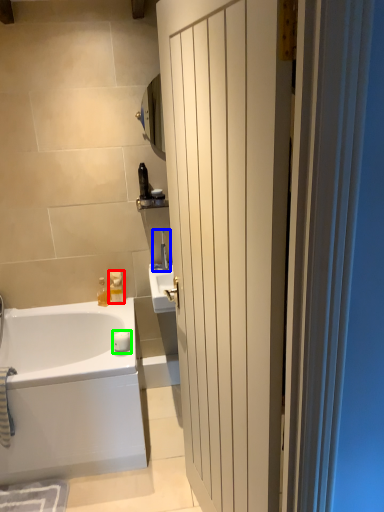
Question: Which object is positioned closest to toiletry (highlighted by a red box)? Select from faucet (highlighted by a blue box) and soap (highlighted by a green box).

Choices:
 (A) faucet
 (B) soap

Answer: (B)